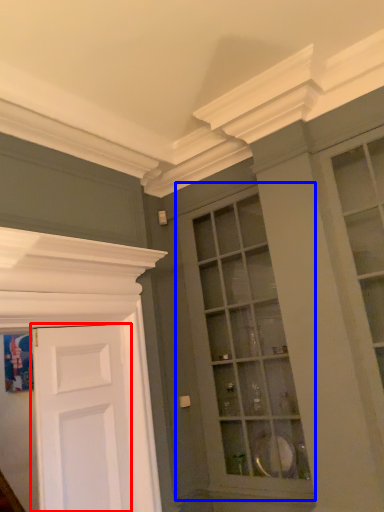
Question: Which point is closer to the camera, door (highlighted by a red box) or window (highlighted by a blue box)?

Choices:
 (A) door
 (B) window

Answer: (A)